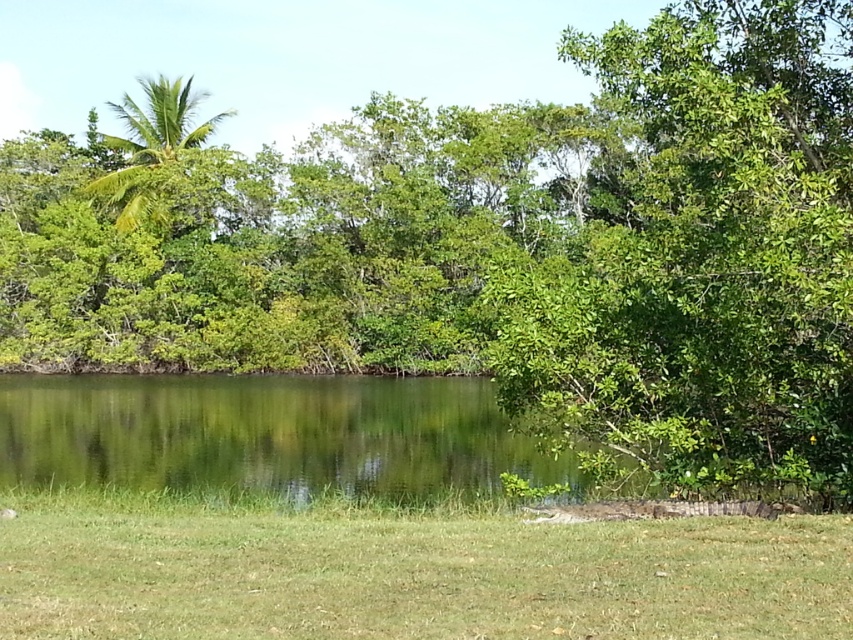
Looking at this image, you are standing at the origin point in the image. You see two points marked as point 1 at coordinates point (734, 406) and point 2 at coordinates point (28, 467). Which point is closer to you?

Point (734, 406) is in front of point (28, 467), so point 1 is closer to you.

You are standing in the scene and want to walk from the green grassy at lower center to the green liquid water at center. Which direction should you move to get closer to the water?

To reach the green liquid water at center from the green grassy at lower center, you should move forward since the green grassy at lower center is closer to the viewer than the green liquid water at center, indicating that the water is further away in the scene.

You are standing at the point marked as point (410, 572) in the image. Based on the scene description, what type of terrain are you currently standing on?

The point (410, 572) corresponds to green grassy at lower center, so you are standing on green grassy terrain.